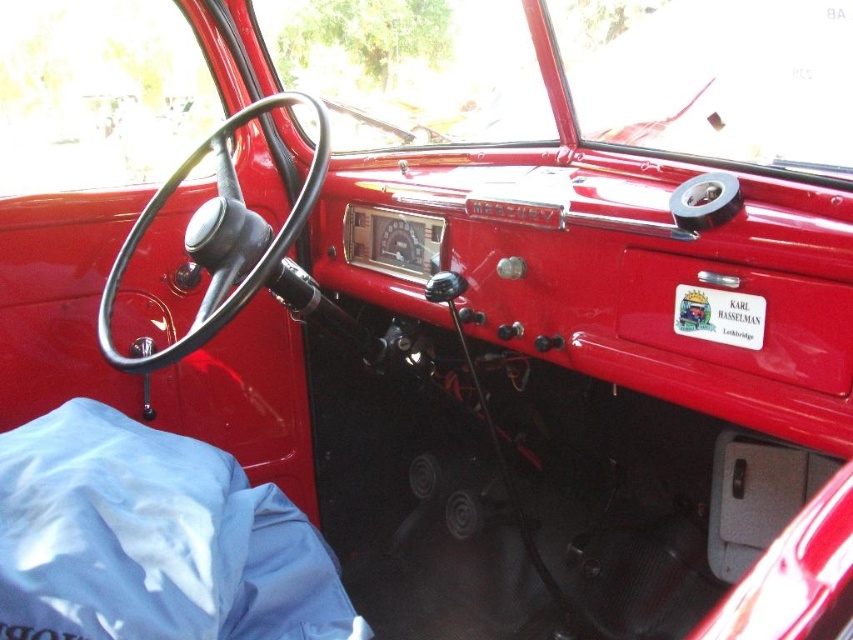
You are sitting in the driver seat of the vintage car with a red interior. You need to reach the black leather steering wheel at center to start the engine. Can you comfortably reach it from your seated position?

The black leather steering wheel at center is 4.03 feet away from the viewer, which is quite far for a typical seated position, so reaching it might be difficult without straining.

You are a mechanic working on a vintage car. You need to install a new control panel that requires precise placement between the black leather steering wheel at center and the white sticker at center. The control panel is 34 inches long. Will it fit between them without overlapping?

The distance between the black leather steering wheel at center and the white sticker at center is 33.93 inches. Since the control panel is 34 inches long, it will not fit as it is slightly longer than the available space.